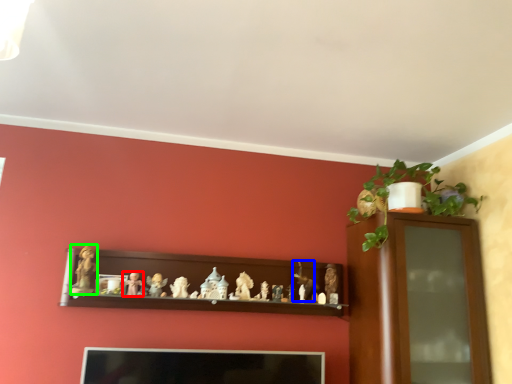
Question: Considering the real-world distances, which object is closest to toy (highlighted by a red box)? toy (highlighted by a blue box) or toy (highlighted by a green box).

Choices:
 (A) toy
 (B) toy

Answer: (B)